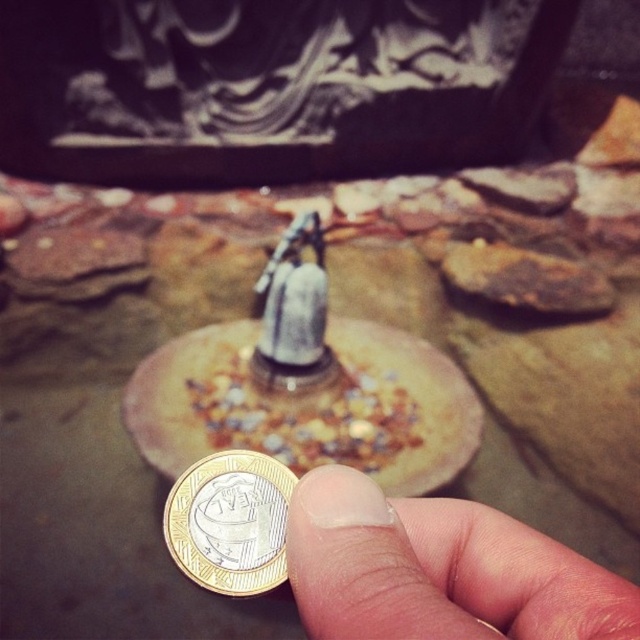
You are a sculptor examining the fountain and notice the smooth skin at center and the gold metallic coin at center. Which object is located to the right of the other?

The smooth skin at center is positioned on the right side of the gold metallic coin at center.

You are standing in front of a small outdoor fountain with a circular base. You notice a gold metallic coin at center and a silver metallic bell at center. Which object is taller?

The silver metallic bell at center is taller than the gold metallic coin at center.

You are a photographer trying to capture the fountain and its surroundings. You notice the smooth skin at center and the gold metallic coin at center. Which object is closer to the camera lens?

The smooth skin at center is closer to the camera lens because it is in front of the gold metallic coin at center.